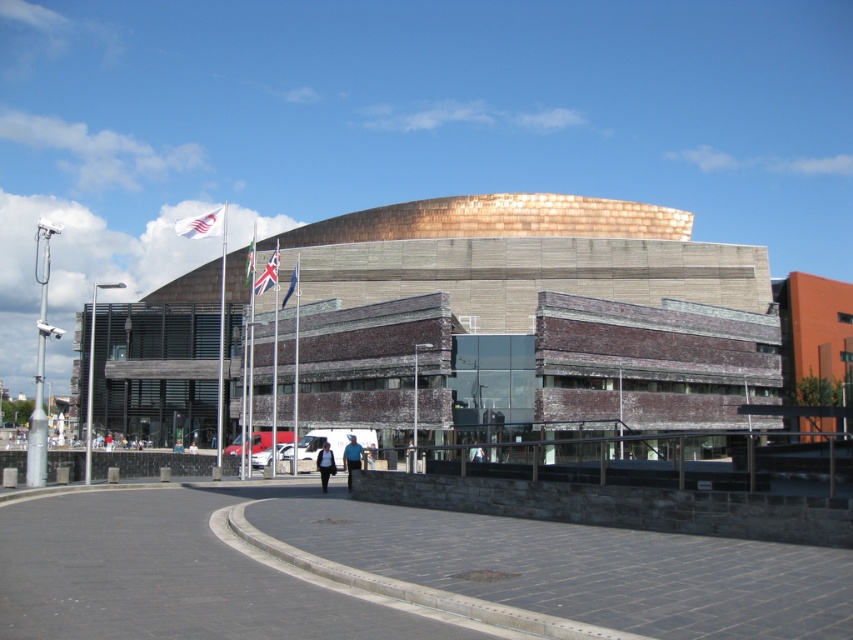
Can you confirm if white fabric flag at upper left is bigger than blue denim jacket at center?

Correct, white fabric flag at upper left is larger in size than blue denim jacket at center.

Between white fabric flag at upper left and blue denim jacket at center, which one appears on the left side from the viewer's perspective?

white fabric flag at upper left

I want to click on white fabric flag at upper left, so click(x=201, y=225).

The image size is (853, 640). In order to click on white fabric flag at upper left in this screenshot , I will do `click(201, 225)`.

In the scene shown: Who is shorter, union jack fabric flag at center or dark gray jacket at center?

dark gray jacket at center is shorter.

Which is more to the left, union jack fabric flag at center or dark gray jacket at center?

union jack fabric flag at center

Does point (277, 257) come closer to viewer compared to point (334, 464)?

No, it is behind (334, 464).

Locate an element on the screen. union jack fabric flag at center is located at coordinates (268, 273).

Which is above, white fabric flag at upper left or white fabric person at center?

white fabric flag at upper left

Does white fabric flag at upper left have a greater height compared to white fabric person at center?

Yes, white fabric flag at upper left is taller than white fabric person at center.

Between point (213, 227) and point (192, 444), which one is positioned behind?

Point (192, 444)

Identify the location of white fabric flag at upper left. The image size is (853, 640). (201, 225).